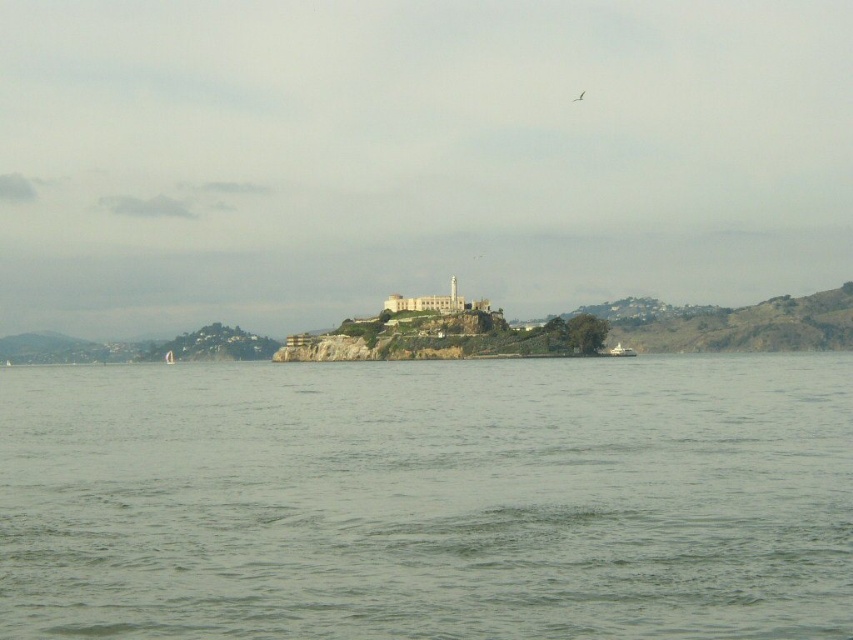
The image size is (853, 640). Describe the element at coordinates (428, 499) in the screenshot. I see `gray water at center` at that location.

Who is more forward, (413, 435) or (167, 356)?

Point (413, 435) is more forward.

This screenshot has height=640, width=853. I want to click on gray water at center, so click(x=428, y=499).

How distant is white stone castle at center from white plastic boat at center?

white stone castle at center is 260.54 feet away from white plastic boat at center.

At what (x,y) coordinates should I click in order to perform the action: click on white stone castle at center. Please return your answer as a coordinate pair (x, y). Looking at the image, I should click on (426, 301).

Who is positioned more to the left, gray water at center or white stone castle at center?

white stone castle at center is more to the left.

Does gray water at center have a greater height compared to white stone castle at center?

Incorrect, gray water at center's height is not larger of white stone castle at center's.

Image resolution: width=853 pixels, height=640 pixels. I want to click on gray water at center, so click(428, 499).